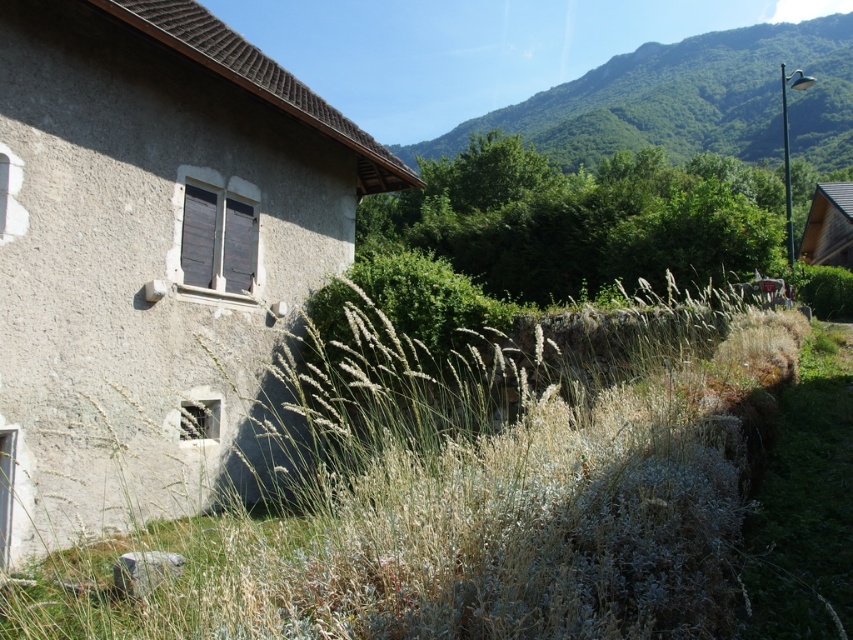
You are standing in front of the rustic stone building and want to see the wooden hut at right. Which direction should you look to see the green leafy hillside at upper center above it?

The green leafy hillside at upper center is positioned over the wooden hut at right, so you should look upward to see the green leafy hillside at upper center above the wooden hut at right.

In the scene shown: You are standing in front of the rustic stone building and notice two points marked in the image. The first point is at coordinates point (438, 486) and the second is at point (827, 237). Which of these points is closer to you?

Point (438, 486) is in front of point (827, 237), so it is closer to you.